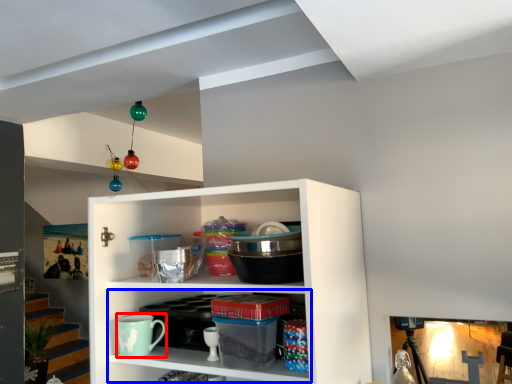
Question: Which point is further to the camera, mug (highlighted by a red box) or cabinet (highlighted by a blue box)?

Choices:
 (A) mug
 (B) cabinet

Answer: (A)